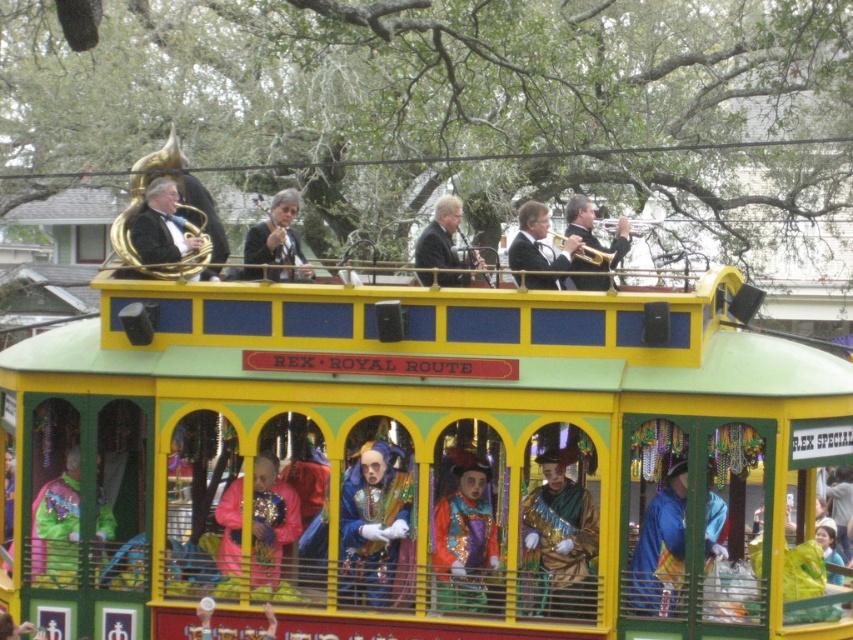
Question: Which point appears farthest from the camera in this image?

Choices:
 (A) (393, 566)
 (B) (555, 500)
 (C) (526, 288)

Answer: (B)

Question: Is yellow/green painted trolley at center to the left of shiny blue costume at center from the viewer's perspective?

Choices:
 (A) yes
 (B) no

Answer: (B)

Question: Which object appears closest to the camera in this image?

Choices:
 (A) pink velvet mask at center
 (B) matte black jacket at center

Answer: (A)

Question: Does shiny blue costume at center have a smaller size compared to matte black jacket at center?

Choices:
 (A) no
 (B) yes

Answer: (B)

Question: Observing the image, what is the correct spatial positioning of matte gold tuba at upper left in reference to black satin suit at center?

Choices:
 (A) above
 (B) below

Answer: (B)

Question: Among these objects, which one is farthest from the camera?

Choices:
 (A) black satin suit at center
 (B) pink velvet mask at center
 (C) shiny multicolored costume at center
 (D) blue velvet hat at center

Answer: (A)